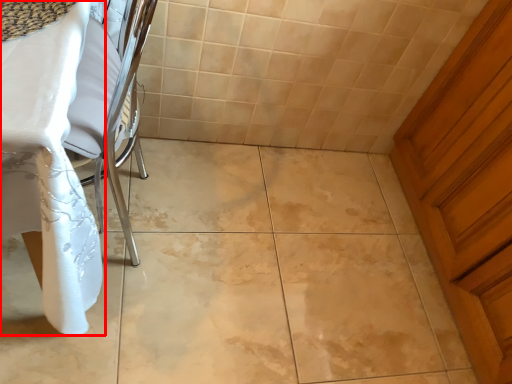
Question: From the image's perspective, what is the correct spatial positioning of table (annotated by the red box) in reference to door?

Choices:
 (A) below
 (B) above

Answer: (B)